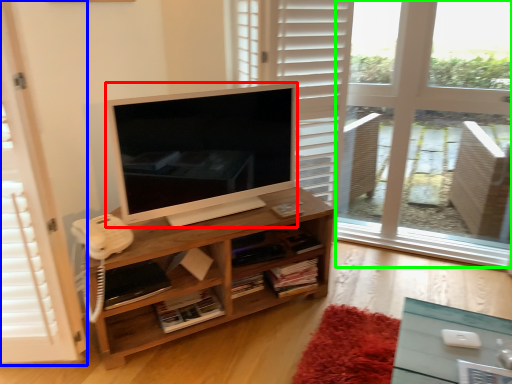
Question: Which object is the closest to the television (highlighted by a red box)? Choose among these: screen door (highlighted by a blue box) or window frame (highlighted by a green box).

Choices:
 (A) screen door
 (B) window frame

Answer: (A)